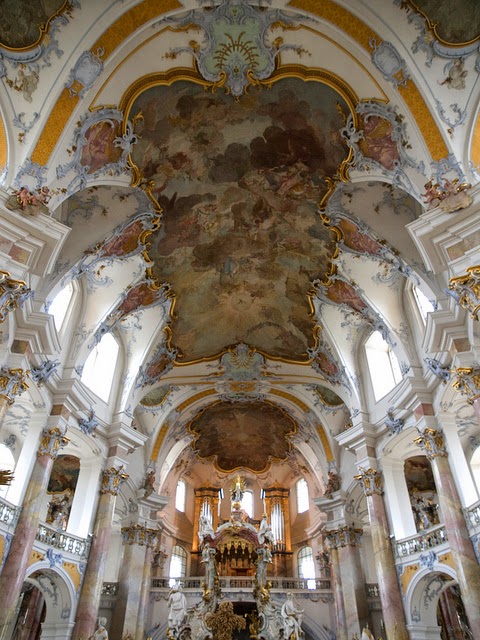
At what (x,y) coordinates should I click in order to perform the action: click on doorways. Please return your answer as a coordinate pair (x, y). Looking at the image, I should click on (x=40, y=620), (x=433, y=618), (x=411, y=496), (x=55, y=504), (x=467, y=440), (x=9, y=449).